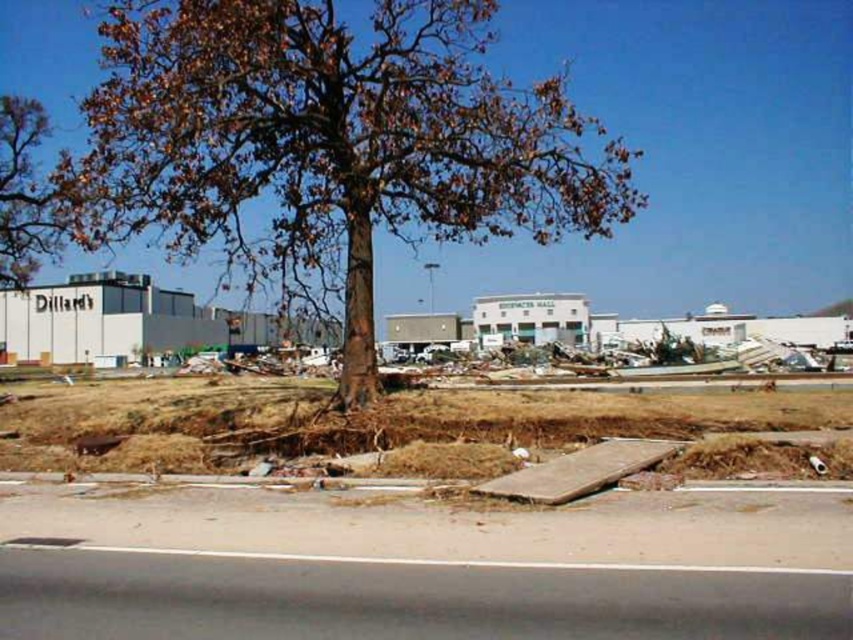
Based on the photo, you are standing at point (10,198) and want to reach point (492,216). Given the debris and destruction around you, is the path directly between these two points clear?

Point (492,216) is in front of point (10,198), so the path between them is clear as there are no obstacles blocking the way.

You are a rescue worker trying to navigate through the debris field. You see the brown rough bark tree at center and the brown leafy tree at upper left. Which tree is positioned to the right of the other?

The brown rough bark tree at center is to the right of the brown leafy tree at upper left.

You are a rescue worker assessing the damage after a storm. You notice two trees in the scene. The first is the brown rough bark tree at center, and the second is the brown leafy tree at upper left. Which tree is closer to the ground?

The brown rough bark tree at center is closer to the ground because it is positioned under the brown leafy tree at upper left.